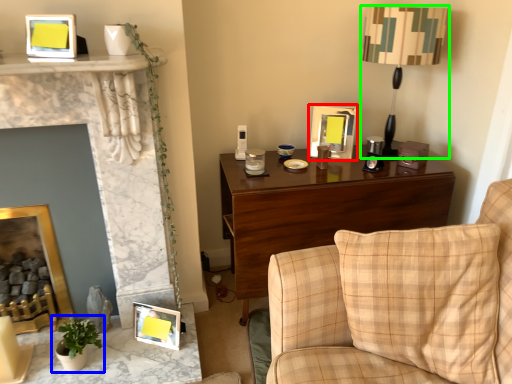
Question: Estimate the real-world distances between objects in this image. Which object is farther from picture frame (highlighted by a red box), houseplant (highlighted by a blue box) or table lamp (highlighted by a green box)?

Choices:
 (A) houseplant
 (B) table lamp

Answer: (A)